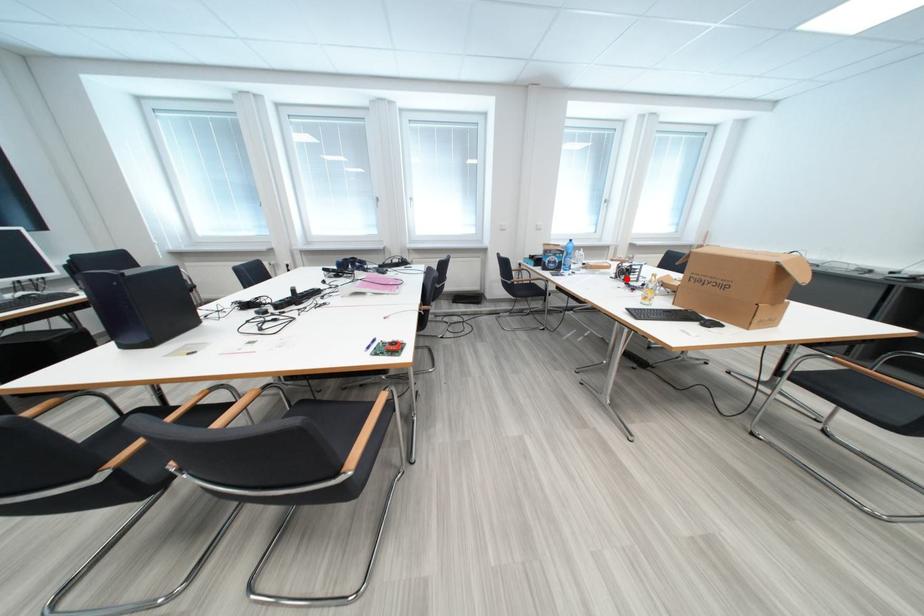
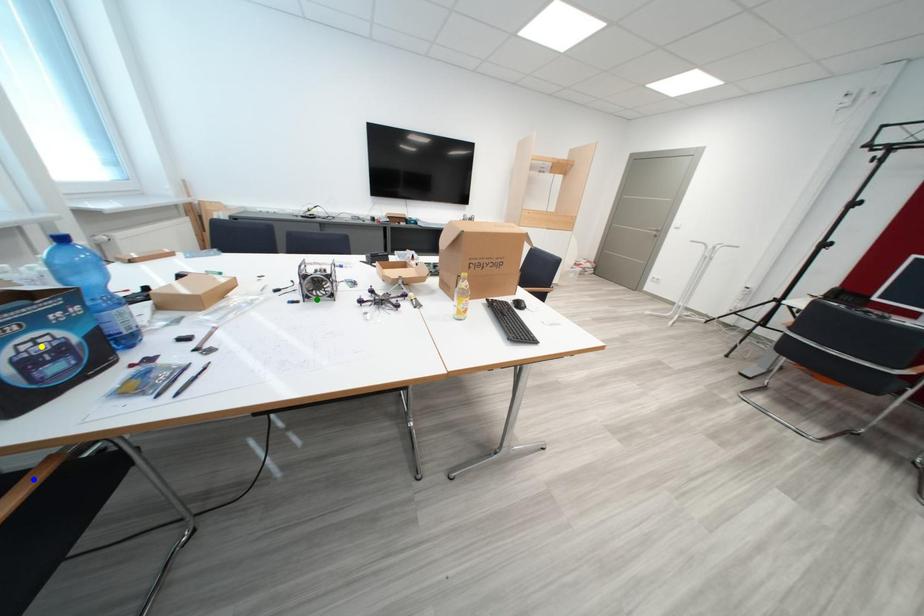
Question: I am providing you with two images of the same scene from different viewpoints. A red point is marked on the first image. You are given multiple points on the second image. In image 2, which mark is for the same physical point as the one in image 1?

Choices:
 (A) green point
 (B) blue point
 (C) yellow point

Answer: (A)